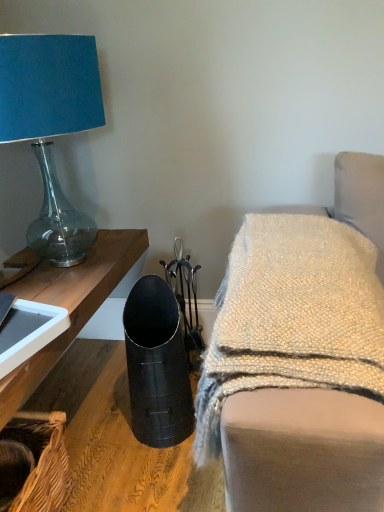
Question: Does point (228, 421) appear closer or farther from the camera than point (66, 477)?

Choices:
 (A) farther
 (B) closer

Answer: (B)

Question: From a real-world perspective, is metallic black vase at lower left physically located above or below woven brown basket at lower left?

Choices:
 (A) below
 (B) above

Answer: (B)

Question: Estimate the real-world distances between objects in this image. Which object is closer to the metallic black vase at lower left?

Choices:
 (A) matte blue fabric lampshade at upper left
 (B) woven brown basket at lower left

Answer: (B)

Question: Estimate the real-world distances between objects in this image. Which object is farther from the matte blue fabric lampshade at upper left?

Choices:
 (A) metallic black vase at lower left
 (B) woven brown basket at lower left

Answer: (B)